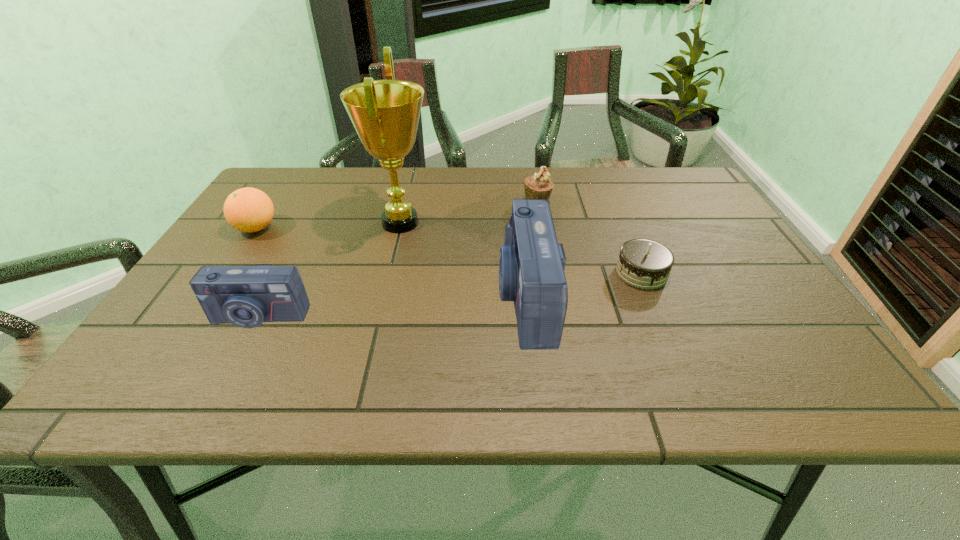
Image resolution: width=960 pixels, height=540 pixels. In order to click on free space located on the lens of the taller camera in this screenshot , I will do `click(412, 297)`.

This screenshot has width=960, height=540. In order to click on vacant region located on the lens of the taller camera in this screenshot , I will do `click(372, 297)`.

Identify the location of free space located 0.330m on the lens of the taller camera. The height and width of the screenshot is (540, 960). (348, 297).

The image size is (960, 540). I want to click on free space located 0.280m on the front of the muffin, so click(x=551, y=278).

Locate an element on the screen. The width and height of the screenshot is (960, 540). free space located on the front of the orange is located at coordinates (211, 295).

Where is `vacant space situated 0.090m on the front view with handles of the fourth object from right to left`? vacant space situated 0.090m on the front view with handles of the fourth object from right to left is located at coordinates (468, 223).

At what (x,y) coordinates should I click in order to perform the action: click on vacant space located 0.170m on the left of the chocolate cake. Please return your answer as a coordinate pair (x, y). Image resolution: width=960 pixels, height=540 pixels. Looking at the image, I should click on (543, 273).

Image resolution: width=960 pixels, height=540 pixels. Find the location of `muffin present at the far edge`. muffin present at the far edge is located at coordinates pos(539,186).

Identify the location of award that is at the far edge. The width and height of the screenshot is (960, 540). (385, 113).

Identify the location of camera that is at the left edge. (246, 296).